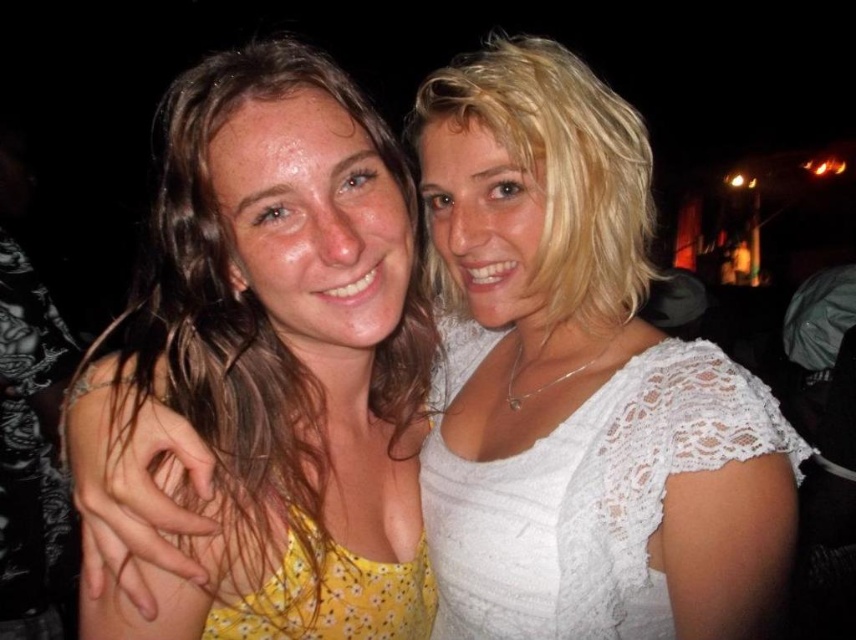
Question: Which of the following is the farthest from the observer?

Choices:
 (A) white lace dress at right
 (B) yellow floral dress at center

Answer: (A)

Question: Can you confirm if yellow floral dress at center is positioned to the right of white lace dress at right?

Choices:
 (A) no
 (B) yes

Answer: (A)

Question: Does yellow floral dress at center have a greater width compared to white lace dress at right?

Choices:
 (A) yes
 (B) no

Answer: (A)

Question: Which point is farther from the camera taking this photo?

Choices:
 (A) (611, 428)
 (B) (295, 60)

Answer: (A)

Question: From the image, what is the correct spatial relationship of yellow floral dress at center in relation to white lace dress at right?

Choices:
 (A) below
 (B) above

Answer: (B)